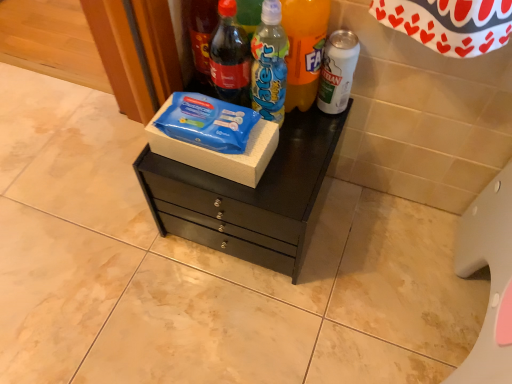
Question: Is the depth of matte glass soda bottle at upper left, the first bottle in the left-to-right sequence, greater than that of black matte chest of drawers at center?

Choices:
 (A) no
 (B) yes

Answer: (A)

Question: Is matte glass soda bottle at upper left, the first bottle in the left-to-right sequence, closer to camera compared to black matte chest of drawers at center?

Choices:
 (A) yes
 (B) no

Answer: (A)

Question: Does matte glass soda bottle at upper left, the first bottle in the left-to-right sequence, touch black matte chest of drawers at center?

Choices:
 (A) no
 (B) yes

Answer: (A)

Question: Can you confirm if matte glass soda bottle at upper left, which is the 5th bottle in right-to-left order, is thinner than black matte chest of drawers at center?

Choices:
 (A) no
 (B) yes

Answer: (B)

Question: Is matte glass soda bottle at upper left, which is the 5th bottle in right-to-left order, at the left side of black matte chest of drawers at center?

Choices:
 (A) yes
 (B) no

Answer: (A)

Question: Considering the positions of matte glass soda bottle at upper left, which is the 5th bottle in right-to-left order, and blue plastic bottle at center, positioned as the third bottle in right-to-left order, in the image, is matte glass soda bottle at upper left, which is the 5th bottle in right-to-left order, taller or shorter than blue plastic bottle at center, positioned as the third bottle in right-to-left order,?

Choices:
 (A) short
 (B) tall

Answer: (B)

Question: Is matte glass soda bottle at upper left, which is the 5th bottle in right-to-left order, bigger or smaller than blue plastic bottle at center, the third bottle when ordered from left to right?

Choices:
 (A) big
 (B) small

Answer: (A)

Question: From a real-world perspective, is matte glass soda bottle at upper left, which is the 5th bottle in right-to-left order, above or below blue plastic bottle at center, positioned as the third bottle in right-to-left order?

Choices:
 (A) below
 (B) above

Answer: (B)

Question: From the image's perspective, is matte glass soda bottle at upper left, the first bottle in the left-to-right sequence, positioned above or below blue plastic bottle at center, positioned as the third bottle in right-to-left order?

Choices:
 (A) above
 (B) below

Answer: (A)

Question: Considering the positions of blue plastic bottle at center, the third bottle when ordered from left to right, and matte glass soda bottle at upper center, which ranks as the fourth bottle in right-to-left order, in the image, is blue plastic bottle at center, the third bottle when ordered from left to right, taller or shorter than matte glass soda bottle at upper center, which ranks as the fourth bottle in right-to-left order,?

Choices:
 (A) short
 (B) tall

Answer: (B)

Question: From the image's perspective, is blue plastic bottle at center, the third bottle when ordered from left to right, above or below matte glass soda bottle at upper center, which ranks as the fourth bottle in right-to-left order?

Choices:
 (A) above
 (B) below

Answer: (B)

Question: From a real-world perspective, relative to matte glass soda bottle at upper center, which appears as the 2th bottle when viewed from the left, is blue plastic bottle at center, the third bottle when ordered from left to right, vertically above or below?

Choices:
 (A) above
 (B) below

Answer: (B)

Question: Is blue plastic bottle at center, positioned as the third bottle in right-to-left order, inside the boundaries of matte glass soda bottle at upper center, which appears as the 2th bottle when viewed from the left, or outside?

Choices:
 (A) outside
 (B) inside

Answer: (A)

Question: Considering the positions of black matte chest of drawers at center and white matte can at right, the first bottle from the right, in the image, is black matte chest of drawers at center bigger or smaller than white matte can at right, the first bottle from the right,?

Choices:
 (A) small
 (B) big

Answer: (B)

Question: Is black matte chest of drawers at center wider or thinner than white matte can at right, which is the fifth bottle from left to right?

Choices:
 (A) thin
 (B) wide

Answer: (B)